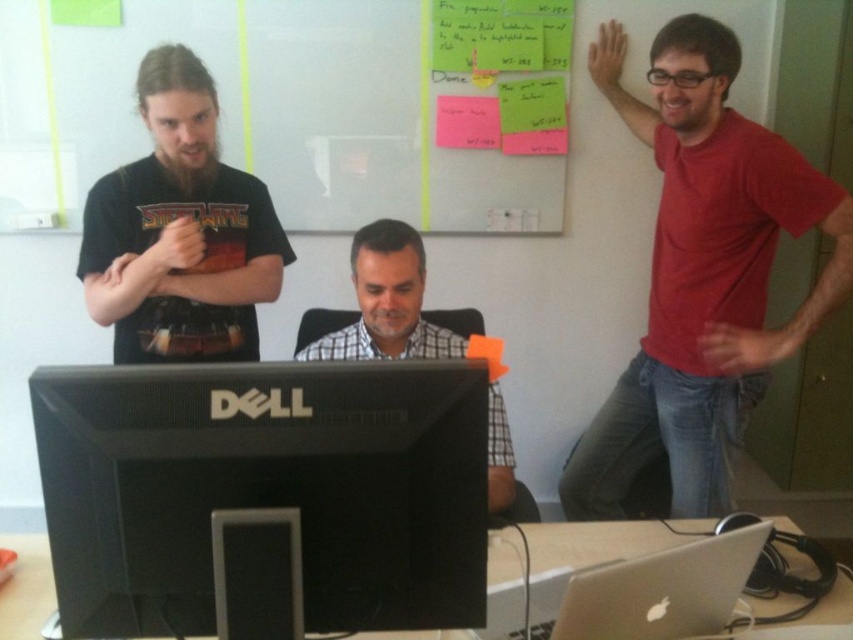
Question: Does green sticky notes at upper center have a smaller size compared to black glossy monitor at center?

Choices:
 (A) yes
 (B) no

Answer: (B)

Question: Which object is positioned farthest from the green paper at upper center?

Choices:
 (A) black matte t-shirt at left
 (B) white glossy table at lower center

Answer: (B)

Question: Among these objects, which one is nearest to the camera?

Choices:
 (A) white checkered shirt at center
 (B) black matte t-shirt at left
 (C) silver metallic laptop at center
 (D) black glossy monitor at center

Answer: (D)

Question: Which point is farther to the camera?

Choices:
 (A) black glossy monitor at center
 (B) white glossy table at lower center
 (C) pink paper at upper center

Answer: (C)

Question: Does white checkered shirt at center appear under green paper at upper center?

Choices:
 (A) yes
 (B) no

Answer: (A)

Question: Does black glossy monitor at center appear under green paper at upper center?

Choices:
 (A) no
 (B) yes

Answer: (B)